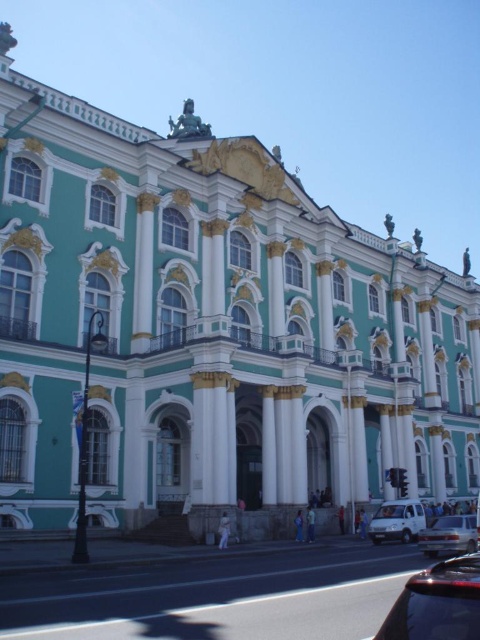
Question: Is shiny black car at lower right to the right of white matte van at lower right from the viewer's perspective?

Choices:
 (A) yes
 (B) no

Answer: (B)

Question: Is shiny black car at lower right positioned in front of white matte van at lower right?

Choices:
 (A) yes
 (B) no

Answer: (A)

Question: Is silver metallic sedan at lower right to the left of white matte van at lower right from the viewer's perspective?

Choices:
 (A) yes
 (B) no

Answer: (B)

Question: Which point is farther to the camera?

Choices:
 (A) (368, 532)
 (B) (469, 538)

Answer: (A)

Question: Which object is farther from the camera taking this photo?

Choices:
 (A) silver metallic sedan at lower right
 (B) white matte van at lower right
 (C) shiny black car at lower right

Answer: (B)

Question: Which is farther from the silver metallic sedan at lower right?

Choices:
 (A) shiny black car at lower right
 (B) white matte van at lower right

Answer: (A)